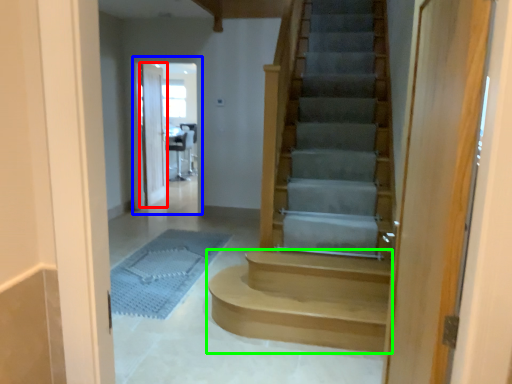
Question: Which object is the farthest from door (highlighted by a red box)? Choose among these: screen door (highlighted by a blue box) or stairs (highlighted by a green box).

Choices:
 (A) screen door
 (B) stairs

Answer: (B)